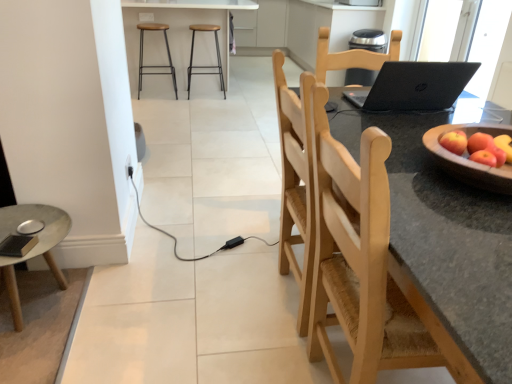
Question: Is red matte apple at right wider than metallic silver barstools at upper center?

Choices:
 (A) no
 (B) yes

Answer: (A)

Question: Is metallic silver barstools at upper center located within red matte apple at right?

Choices:
 (A) no
 (B) yes

Answer: (A)

Question: From the image's perspective, is red matte apple at right located above metallic silver barstools at upper center?

Choices:
 (A) yes
 (B) no

Answer: (B)

Question: Is red matte apple at right placed right next to metallic silver barstools at upper center?

Choices:
 (A) no
 (B) yes

Answer: (A)

Question: Is the depth of red matte apple at right greater than that of metallic silver barstools at upper center?

Choices:
 (A) yes
 (B) no

Answer: (B)

Question: Is point coord(188,64) positioned closer to the camera than point coord(312,190)?

Choices:
 (A) closer
 (B) farther

Answer: (B)

Question: Is wooden stool at center, acting as the first stool starting from the right, situated inside wooden chair at center or outside?

Choices:
 (A) outside
 (B) inside

Answer: (A)

Question: Considering the positions of wooden stool at center, acting as the first stool starting from the right, and wooden chair at center in the image, is wooden stool at center, acting as the first stool starting from the right, taller or shorter than wooden chair at center?

Choices:
 (A) tall
 (B) short

Answer: (B)

Question: From the image's perspective, is wooden stool at center, acting as the first stool starting from the right, located above or below wooden chair at center?

Choices:
 (A) above
 (B) below

Answer: (A)

Question: From the image's perspective, is matte wooden desk at lower left located above or below metallic silver barstools at upper center?

Choices:
 (A) below
 (B) above

Answer: (A)

Question: Visually, is matte wooden desk at lower left positioned to the left or to the right of metallic silver barstools at upper center?

Choices:
 (A) right
 (B) left

Answer: (B)

Question: Considering the positions of point (65, 220) and point (131, 21), is point (65, 220) closer or farther from the camera than point (131, 21)?

Choices:
 (A) closer
 (B) farther

Answer: (A)

Question: Is matte wooden desk at lower left bigger or smaller than metallic silver barstools at upper center?

Choices:
 (A) big
 (B) small

Answer: (B)

Question: From a real-world perspective, is matte wooden desk at lower left positioned above or below black matte laptop at center?

Choices:
 (A) above
 (B) below

Answer: (B)

Question: Is point (29, 210) closer or farther from the camera than point (385, 77)?

Choices:
 (A) farther
 (B) closer

Answer: (A)